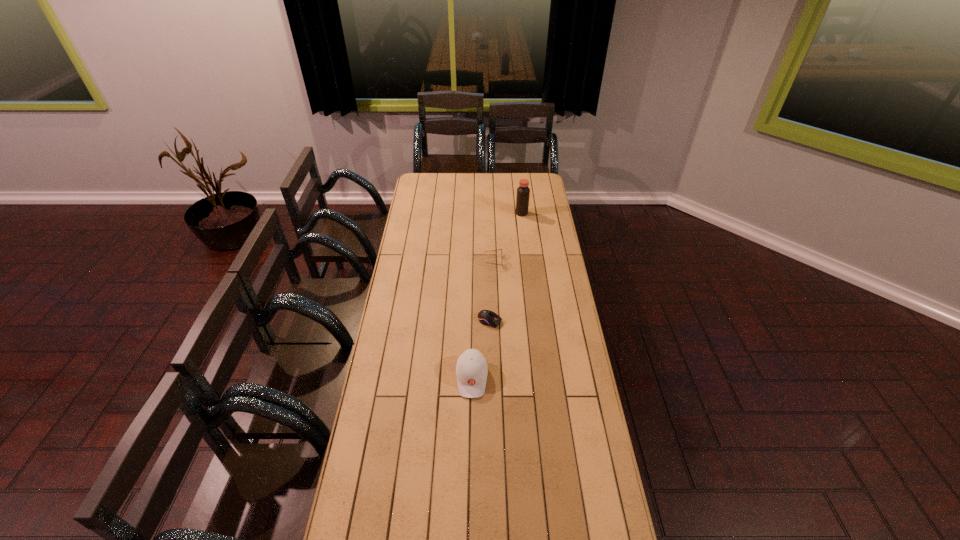
The height and width of the screenshot is (540, 960). I want to click on the tallest object, so click(x=523, y=192).

Locate an element on the screen. Image resolution: width=960 pixels, height=540 pixels. the rightmost object is located at coordinates (523, 192).

I want to click on the nearest object, so click(x=471, y=369).

Find the location of `the second tallest object`. the second tallest object is located at coordinates (471, 369).

The image size is (960, 540). In order to click on the third nearest object in this screenshot , I will do click(498, 249).

What are the coordinates of `the second nearest object` in the screenshot? It's located at (486, 317).

Locate an element on the screen. vacant space located 0.100m on the front of the vinegar is located at coordinates (523, 227).

Where is `vacant space located on the front-facing side of the baseball cap`? The image size is (960, 540). vacant space located on the front-facing side of the baseball cap is located at coordinates (471, 421).

The height and width of the screenshot is (540, 960). I want to click on vacant area situated 0.290m on the front-facing side of the third nearest object, so click(428, 261).

The image size is (960, 540). I want to click on free point located 0.400m on the front-facing side of the third nearest object, so click(x=407, y=261).